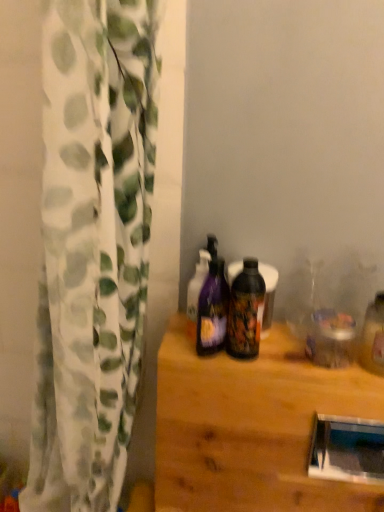
This screenshot has width=384, height=512. I want to click on vacant space to the right of glossy plastic bottle at center, the first bottle in the right-to-left sequence, so click(287, 352).